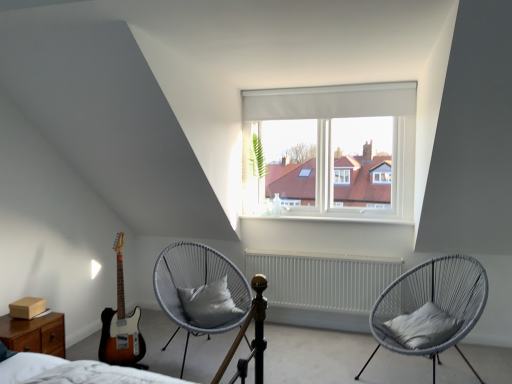
Question: Is point (231, 309) closer or farther from the camera than point (35, 329)?

Choices:
 (A) closer
 (B) farther

Answer: (B)

Question: From a real-world perspective, relative to brown wood nightstand at lower left, is gray fabric pillow at center, positioned as the second pillow in front-to-back order, vertically above or below?

Choices:
 (A) above
 (B) below

Answer: (A)

Question: Which is nearer to the gray woven chair at center, which is counted as the second chair, starting from the left?

Choices:
 (A) sunburst wood guitar at left
 (B) gray fabric pillow at center, which is the 1th pillow in back-to-front order
 (C) gray fabric pillow at lower right, which is counted as the second pillow, starting from the left
 (D) brown wood nightstand at lower left
 (E) white matte radiator at center

Answer: (C)

Question: Estimate the real-world distances between objects in this image. Which object is closer to the brown wood nightstand at lower left?

Choices:
 (A) gray woven chair at center, the first chair when ordered from right to left
 (B) gray fabric pillow at center, which is the 1th pillow in back-to-front order
 (C) gray woven chair with cushion at center, the 2th chair when ordered from right to left
 (D) gray fabric pillow at lower right, which is counted as the second pillow, starting from the left
 (E) white matte radiator at center

Answer: (C)